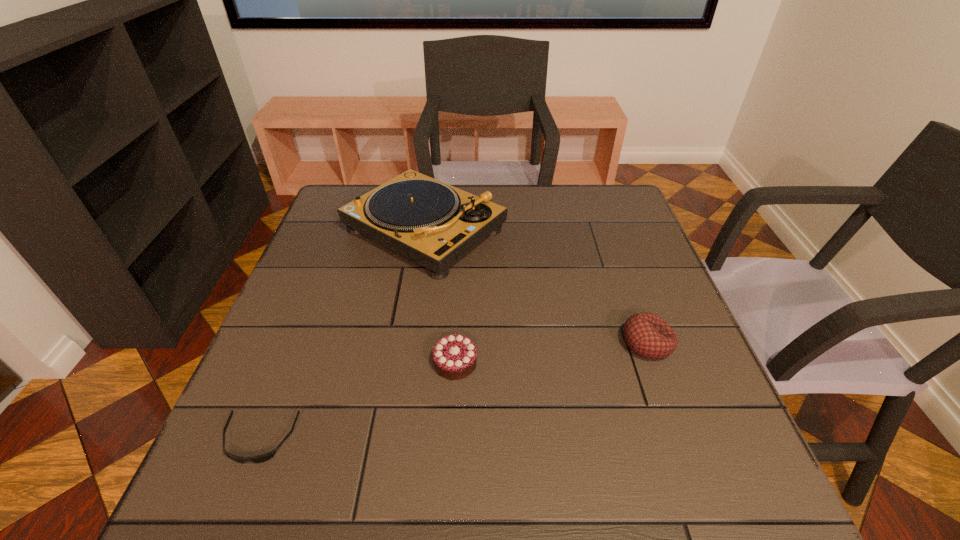
This screenshot has width=960, height=540. What are the coordinates of `blank space at the right edge of the desktop` in the screenshot? It's located at (640, 294).

In the image, there is a desktop. Where is `vacant area at the near left corner`? vacant area at the near left corner is located at coordinates click(x=203, y=506).

Find the location of a particular element. free space at the far right corner of the desktop is located at coordinates (581, 190).

Where is `vacant region at the near right corner`? vacant region at the near right corner is located at coordinates (734, 496).

Identify the location of free area in between the sunglasses and the second shortest object. Image resolution: width=960 pixels, height=540 pixels. (357, 401).

I want to click on free space between the third tallest object and the beanbag, so click(x=551, y=353).

Locate an element on the screen. This screenshot has width=960, height=540. blank region between the rightmost object and the tallest object is located at coordinates (536, 287).

Where is `empty space that is in between the second shortest object and the record player`? The height and width of the screenshot is (540, 960). empty space that is in between the second shortest object and the record player is located at coordinates (440, 296).

The image size is (960, 540). I want to click on vacant point located between the beanbag and the shortest object, so click(x=453, y=392).

Locate an element on the screen. The height and width of the screenshot is (540, 960). unoccupied area between the third tallest object and the sunglasses is located at coordinates (357, 401).